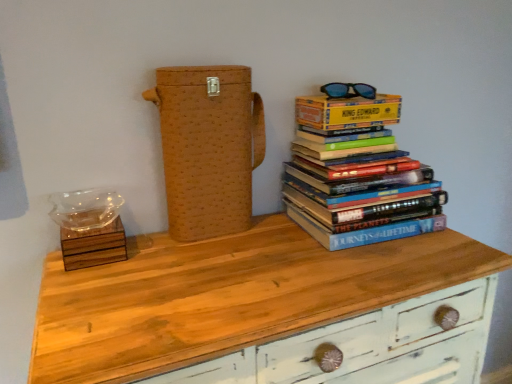
Find the location of a particular element. blank space situated above wooden chest of drawers at center (from a real-world perspective) is located at coordinates point(246,264).